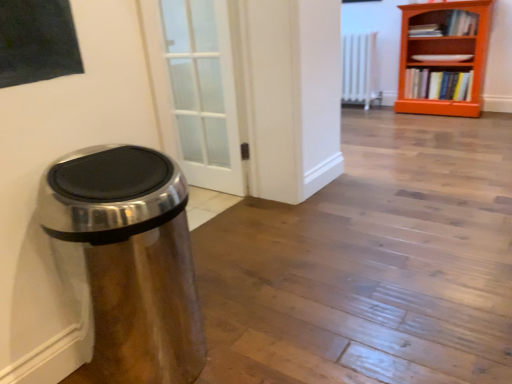
Image resolution: width=512 pixels, height=384 pixels. Find the location of `free space above white metallic radiator at center (from a real-world perspective)`. free space above white metallic radiator at center (from a real-world perspective) is located at coordinates (358, 31).